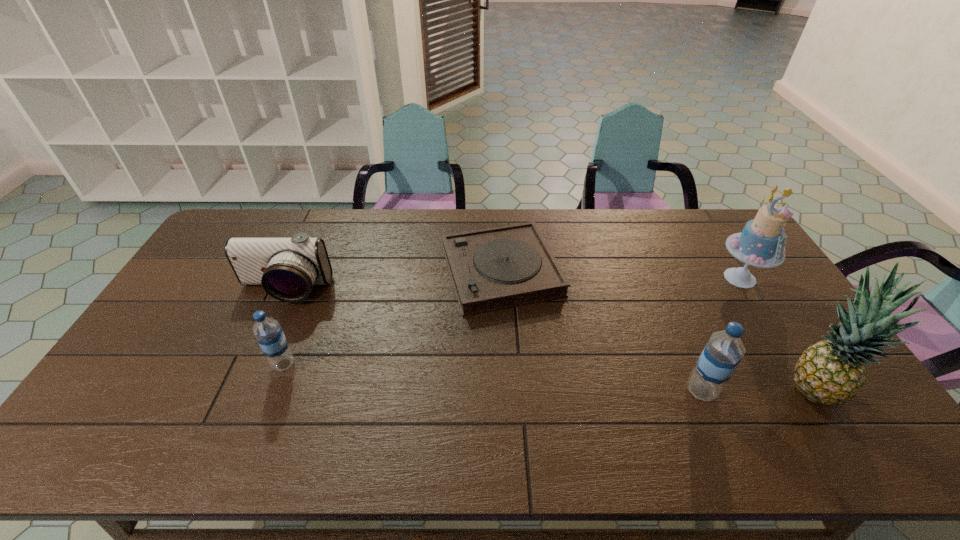
Identify the location of object that is at the near right corner. [832, 372].

The image size is (960, 540). I want to click on free space at the far edge, so click(659, 230).

Where is `free space at the near edge of the desktop`? The width and height of the screenshot is (960, 540). free space at the near edge of the desktop is located at coordinates (176, 405).

Identify the location of free region at the left edge. This screenshot has height=540, width=960. pyautogui.click(x=148, y=348).

Where is `free space at the far right corner of the desktop`? Image resolution: width=960 pixels, height=540 pixels. free space at the far right corner of the desktop is located at coordinates (686, 216).

Identify the location of free space between the cake and the farther water bottle. The width and height of the screenshot is (960, 540). pos(512,321).

Identify the location of vacant area between the pineapple and the farther water bottle. (547, 376).

I want to click on free space between the shortest object and the camcorder, so click(393, 281).

Locate an element on the screen. empty space that is in between the pineapple and the camcorder is located at coordinates (547, 339).

Where is `vacant area that lies between the second tallest object and the shorter water bottle`? The image size is (960, 540). vacant area that lies between the second tallest object and the shorter water bottle is located at coordinates (512, 321).